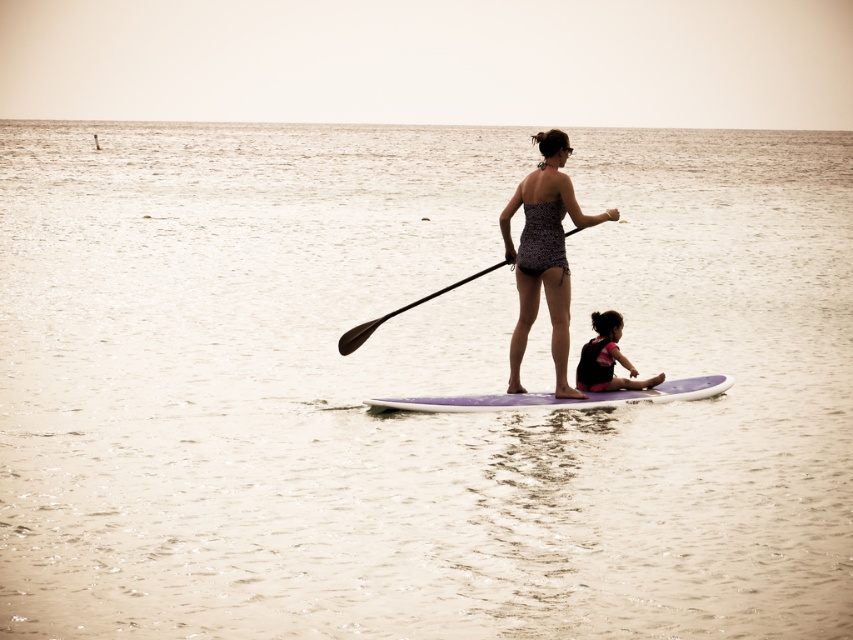
You are a photographer trying to capture the scene of the woman on the paddleboard. You notice the matte pink swimsuit at center and the black rubber paddle at center. Based on their positions, which object is closer to the water surface?

The matte pink swimsuit at center is below the black rubber paddle at center, meaning the swimsuit is closer to the water surface.

You are a photographer trying to capture a closeup shot of both the matte pink swimsuit at center and the black rubber paddle at center from a drone. The drone has a camera with a maximum focus range of 1.5 meters. Can the drone capture both objects in focus at the same time?

The distance between the matte pink swimsuit at center and the black rubber paddle at center is 1.34 meters, which is within the drone camera maximum focus range of 1.5 meters. Therefore, the drone can capture both objects in focus simultaneously.

You are a photographer trying to capture a clear photo of the printed fabric swimsuit at center and the black rubber paddle at center. Which object should you focus on first to ensure both are in focus?

The printed fabric swimsuit at center is in front of the black rubber paddle at center, so you should focus on the printed fabric swimsuit at center first to ensure both are in focus.